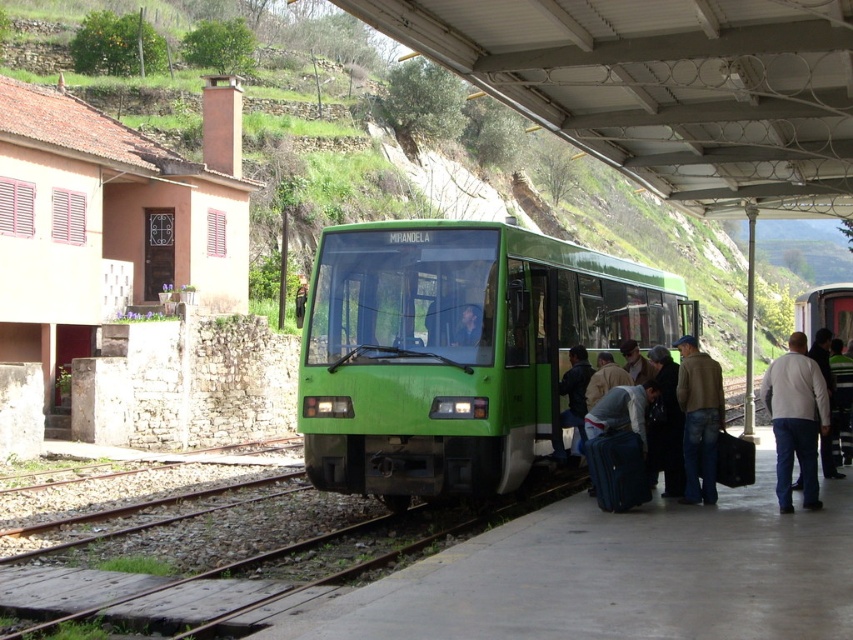
Measure the distance between white cotton shirt at right and denim jeans at lower right.

38.10 inches

The width and height of the screenshot is (853, 640). What do you see at coordinates (796, 419) in the screenshot?
I see `white cotton shirt at right` at bounding box center [796, 419].

Who is more distant from viewer, (770, 417) or (715, 500)?

Positioned behind is point (715, 500).

At what (x,y) coordinates should I click in order to perform the action: click on white cotton shirt at right. Please return your answer as a coordinate pair (x, y). Looking at the image, I should click on (796, 419).

Is point (520, 426) farther from viewer compared to point (708, 385)?

Yes, point (520, 426) is behind point (708, 385).

Who is positioned more to the left, green matte train at center or denim jeans at lower right?

green matte train at center

Between point (326, 237) and point (688, 416), which one is positioned behind?

The point (326, 237) is behind.

Where is `green matte train at center`? This screenshot has width=853, height=640. green matte train at center is located at coordinates (456, 352).

Is green matte train at center to the right of white cotton shirt at right from the viewer's perspective?

No, green matte train at center is not to the right of white cotton shirt at right.

Does green matte train at center have a larger size compared to white cotton shirt at right?

No, green matte train at center is not bigger than white cotton shirt at right.

The image size is (853, 640). Find the location of `green matte train at center`. green matte train at center is located at coordinates (456, 352).